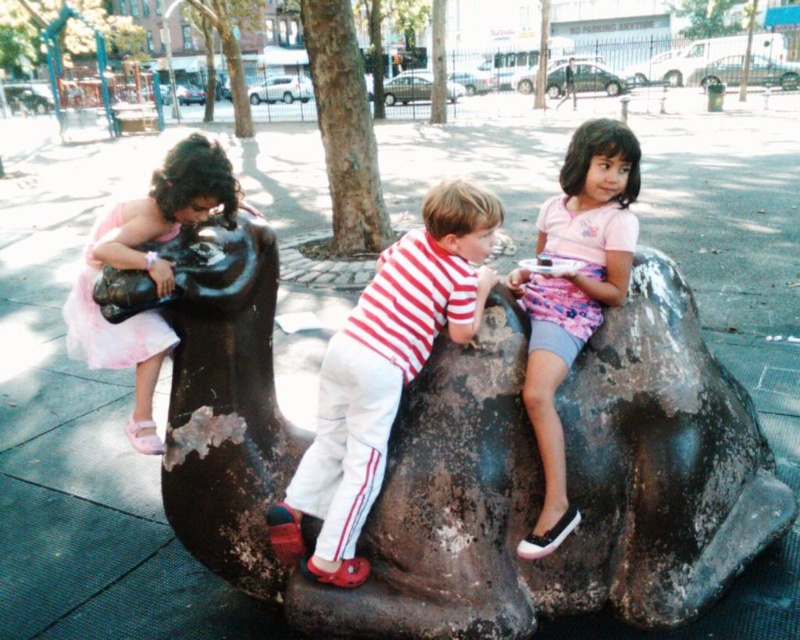
Can you confirm if matte red-striped shirt at center is thinner than pink fabric skirt at upper right?

No.

The height and width of the screenshot is (640, 800). In order to click on matte red-striped shirt at center in this screenshot , I will do `click(384, 372)`.

Does rusty metal sculpture at center have a lesser width compared to pink tulle dress at left?

In fact, rusty metal sculpture at center might be wider than pink tulle dress at left.

Locate an element on the screen. rusty metal sculpture at center is located at coordinates (480, 467).

I want to click on rusty metal sculpture at center, so click(x=480, y=467).

Who is more forward, [478,298] or [169,154]?

Point [478,298] is more forward.

Is point (378, 486) closer to camera compared to point (225, 204)?

Yes, point (378, 486) is closer to viewer.

Which is behind, point (446, 276) or point (104, 243)?

Positioned behind is point (446, 276).

The width and height of the screenshot is (800, 640). In order to click on matte red-striped shirt at center in this screenshot , I will do `click(384, 372)`.